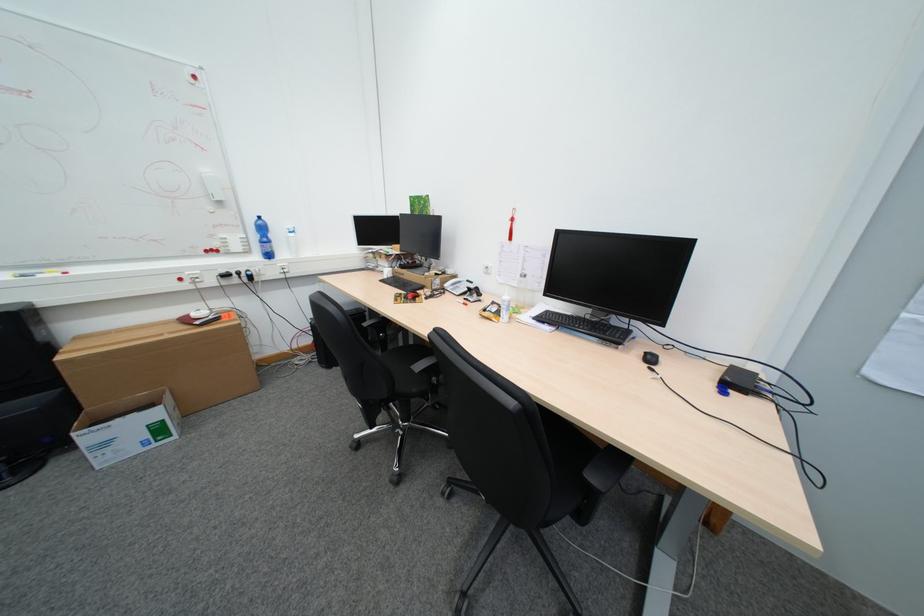
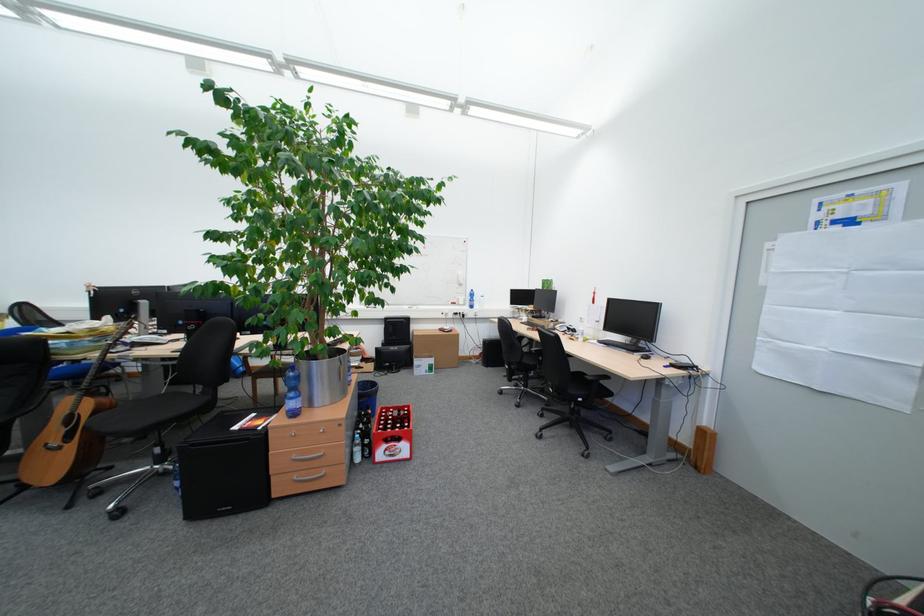
The point at (662, 360) is marked in the first image. Where is the corresponding point in the second image?

(658, 359)